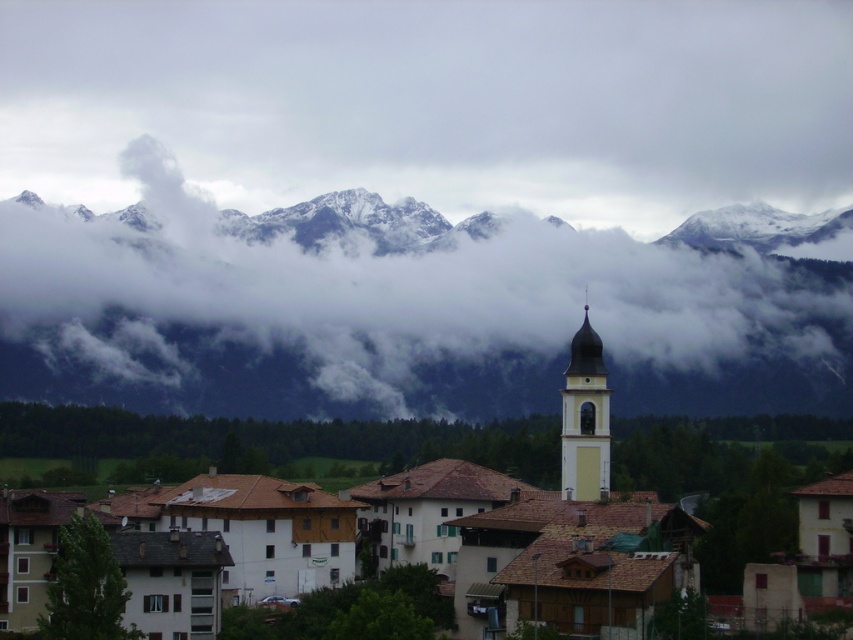
Question: Does matte brown building at center have a smaller size compared to smooth cream steeple at center-right?

Choices:
 (A) yes
 (B) no

Answer: (B)

Question: Among these points, which one is farthest from the camera?

Choices:
 (A) (167, 419)
 (B) (578, 480)
 (C) (297, 371)

Answer: (C)

Question: Does snowy rock mountain range at upper center appear over smooth cream steeple at center-right?

Choices:
 (A) yes
 (B) no

Answer: (A)

Question: Which point is farther from the camera taking this photo?

Choices:
 (A) (300, 445)
 (B) (103, 307)

Answer: (B)

Question: Which of these objects is positioned closest to the smooth cream steeple at center-right?

Choices:
 (A) snowy rock mountain range at upper center
 (B) matte brown building at center

Answer: (B)

Question: Is matte brown building at center to the left of smooth cream steeple at center-right from the viewer's perspective?

Choices:
 (A) yes
 (B) no

Answer: (B)